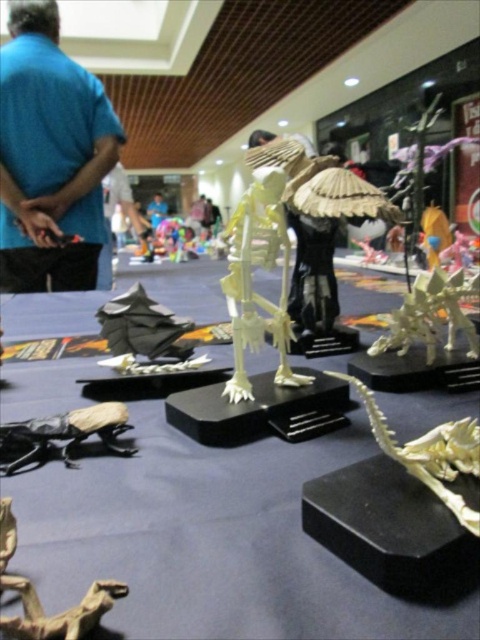
Question: Which of the following is the farthest from the observer?

Choices:
 (A) shiny gold dragon at lower right
 (B) matte black beetle at lower left

Answer: (B)

Question: Does blue fabric shirt at upper left appear on the right side of matte black beetle at lower left?

Choices:
 (A) no
 (B) yes

Answer: (A)

Question: Which object is the closest to the matte black beetle at lower left?

Choices:
 (A) blue fabric shirt at upper left
 (B) shiny gold dragon at lower right
 (C) translucent white skeleton at center
 (D) brown paper-like dinosaur at lower left

Answer: (C)

Question: Which of the following is the farthest from the observer?

Choices:
 (A) (27, 124)
 (B) (0, 451)
 (C) (40, 611)
 (D) (282, 182)

Answer: (A)

Question: Can you confirm if blue fabric shirt at upper left is positioned to the left of matte black beetle at lower left?

Choices:
 (A) no
 (B) yes

Answer: (B)

Question: Is shiny gold dragon at lower right below brown paper-like dinosaur at lower left?

Choices:
 (A) yes
 (B) no

Answer: (B)